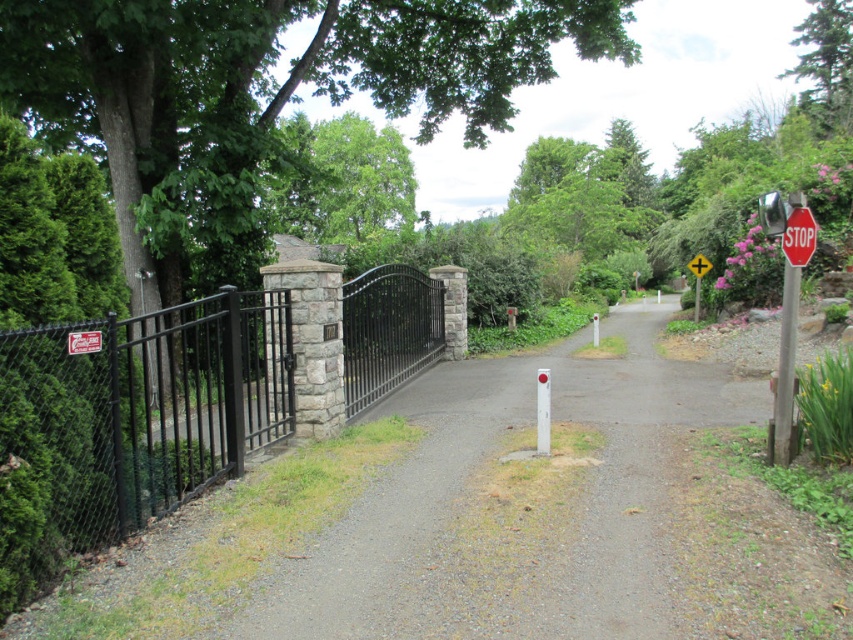
Based on the photo, can you confirm if green leafy tree at left is positioned below brushed metal sign at upper left?

No, green leafy tree at left is not below brushed metal sign at upper left.

Where is `green leafy tree at left`? The height and width of the screenshot is (640, 853). green leafy tree at left is located at coordinates (259, 97).

Where is `black metal fence at left`? The image size is (853, 640). black metal fence at left is located at coordinates (131, 422).

Which of these two, black metal fence at left or brushed metal sign at upper left, stands taller?

black metal fence at left

Does point (13, 545) come in front of point (74, 337)?

Yes, point (13, 545) is closer to viewer.

This screenshot has height=640, width=853. I want to click on black metal fence at left, so click(131, 422).

Which of these two, green leafy tree at left or yellow plastic sign at center, stands taller?

Standing taller between the two is green leafy tree at left.

Where is `green leafy tree at left`? Image resolution: width=853 pixels, height=640 pixels. green leafy tree at left is located at coordinates (259, 97).